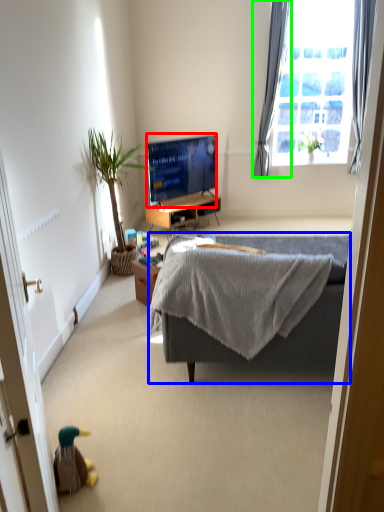
Question: Considering the real-world distances, which object is farthest from television (highlighted by a red box)? studio couch (highlighted by a blue box) or curtain (highlighted by a green box)?

Choices:
 (A) studio couch
 (B) curtain

Answer: (A)